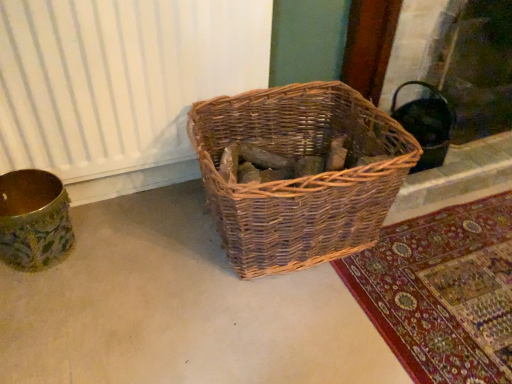
This screenshot has width=512, height=384. Find the location of `vacant space to the right of natural woven basket at center`. vacant space to the right of natural woven basket at center is located at coordinates (445, 262).